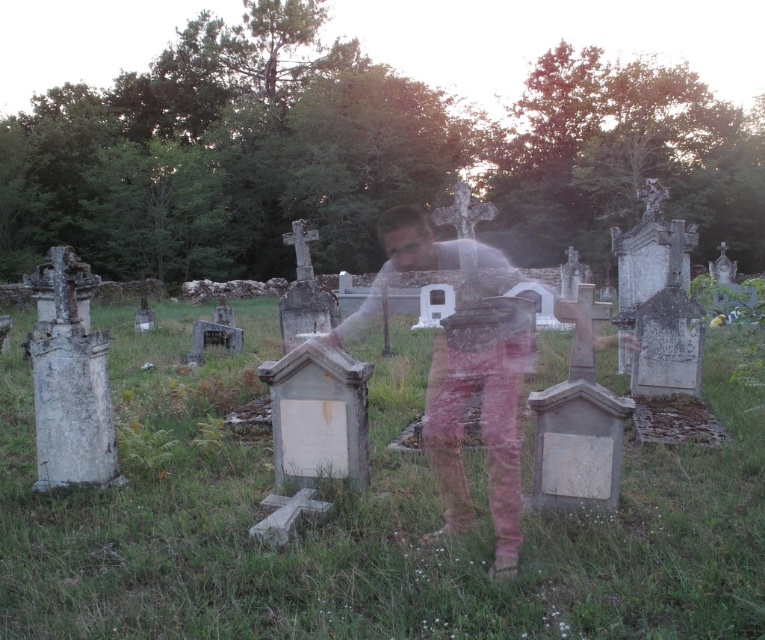
Question: Among these points, which one is nearest to the camera?

Choices:
 (A) (728, 563)
 (B) (461, 406)

Answer: (A)

Question: In this image, where is white stone tombstones at center located relative to pink cotton pants at center?

Choices:
 (A) right
 (B) left

Answer: (B)

Question: Where is white stone tombstones at center located in relation to pink cotton pants at center in the image?

Choices:
 (A) above
 (B) below

Answer: (B)

Question: Can you confirm if white stone tombstones at center is positioned above pink cotton pants at center?

Choices:
 (A) no
 (B) yes

Answer: (A)